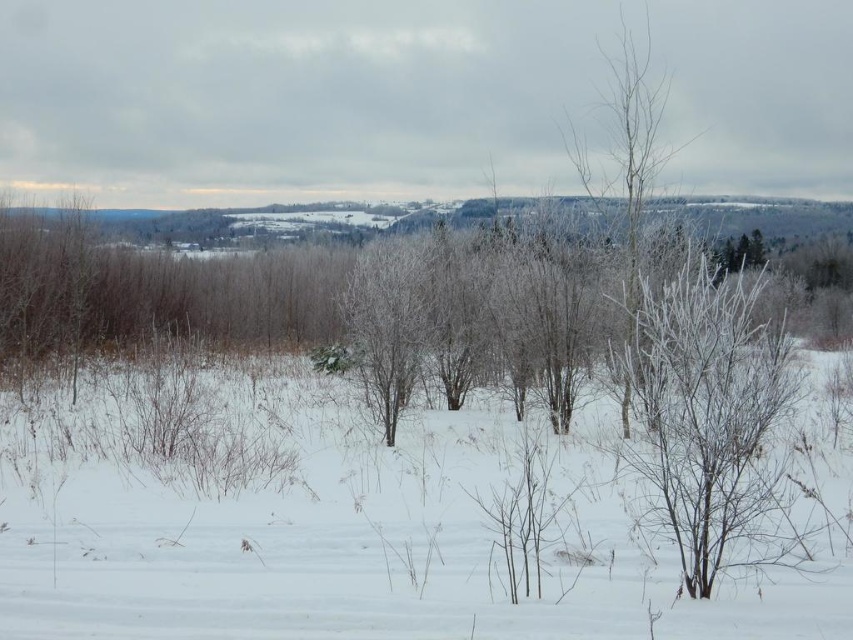
Between frosted branches at right and frosted white tree at upper right, which one has more height?

frosted white tree at upper right is taller.

Does frosted branches at right have a smaller size compared to frosted white tree at upper right?

Correct, frosted branches at right occupies less space than frosted white tree at upper right.

Between point (753, 454) and point (639, 80), which one is positioned behind?

Positioned behind is point (639, 80).

The width and height of the screenshot is (853, 640). In order to click on frosted branches at right in this screenshot , I will do `click(714, 420)`.

Who is taller, white fluffy snow at center or frosted white tree at upper right?

frosted white tree at upper right

Can you confirm if white fluffy snow at center is positioned below frosted white tree at upper right?

Correct, white fluffy snow at center is located below frosted white tree at upper right.

Is point (466, 436) more distant than point (643, 145)?

No, it is not.

The image size is (853, 640). What are the coordinates of `white fluffy snow at center` in the screenshot? It's located at (368, 554).

In the scene shown: Can you confirm if white fluffy snow at center is taller than frosted branches at right?

Incorrect, white fluffy snow at center's height is not larger of frosted branches at right's.

From the picture: Is white fluffy snow at center further to camera compared to frosted branches at right?

Yes, it is behind frosted branches at right.

At what (x,y) coordinates should I click in order to perform the action: click on white fluffy snow at center. Please return your answer as a coordinate pair (x, y). The image size is (853, 640). Looking at the image, I should click on (368, 554).